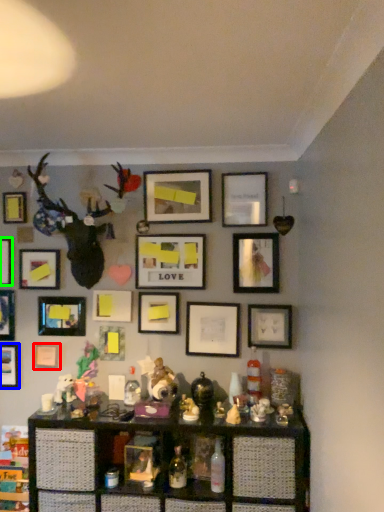
Question: Considering the real-world distances, which object is closest to picture frame (highlighted by a red box)? picture frame (highlighted by a blue box) or picture frame (highlighted by a green box).

Choices:
 (A) picture frame
 (B) picture frame

Answer: (A)